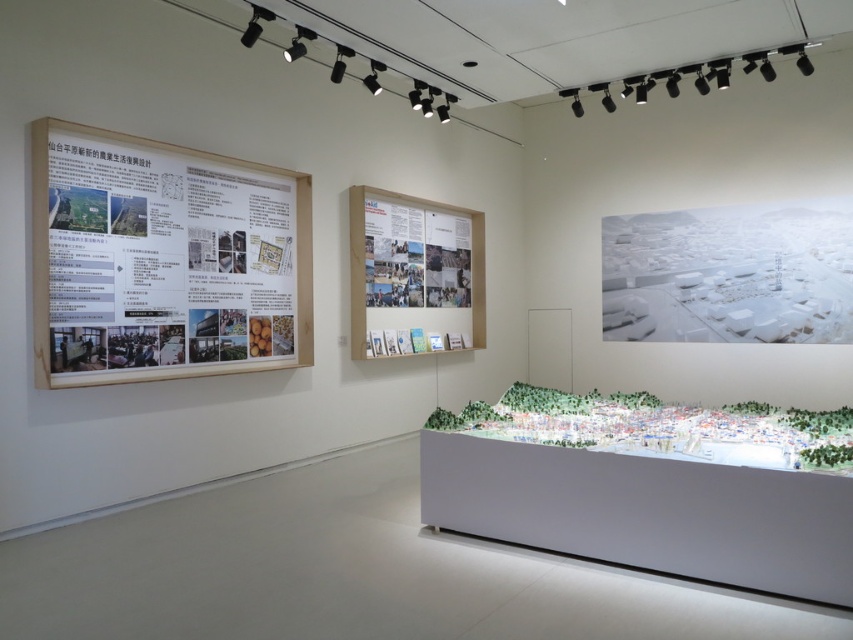
Which is above, wooden frame at center or matte paper poster at center?

matte paper poster at center

Who is shorter, wooden frame at center or matte paper poster at center?

matte paper poster at center is shorter.

Where is `wooden frame at center`? Image resolution: width=853 pixels, height=640 pixels. wooden frame at center is located at coordinates (413, 275).

Identify the location of wooden frame at center. Image resolution: width=853 pixels, height=640 pixels. (413, 275).

Who is shorter, white matte cityscape at center or matte paper poster at center?

With less height is matte paper poster at center.

Can you confirm if white matte cityscape at center is smaller than matte paper poster at center?

Incorrect, white matte cityscape at center is not smaller in size than matte paper poster at center.

At what (x,y) coordinates should I click in order to perform the action: click on white matte cityscape at center. Please return your answer as a coordinate pair (x, y). This screenshot has width=853, height=640. Looking at the image, I should click on (730, 273).

Is wooden frame poster at upper left bigger than wooden frame at center?

Yes, wooden frame poster at upper left is bigger than wooden frame at center.

Which is in front, point (186, 326) or point (424, 317)?

Point (186, 326) is in front.

Between point (33, 272) and point (368, 321), which one is positioned behind?

The point (368, 321) is more distant.

This screenshot has height=640, width=853. Identify the location of wooden frame poster at upper left. click(x=163, y=260).